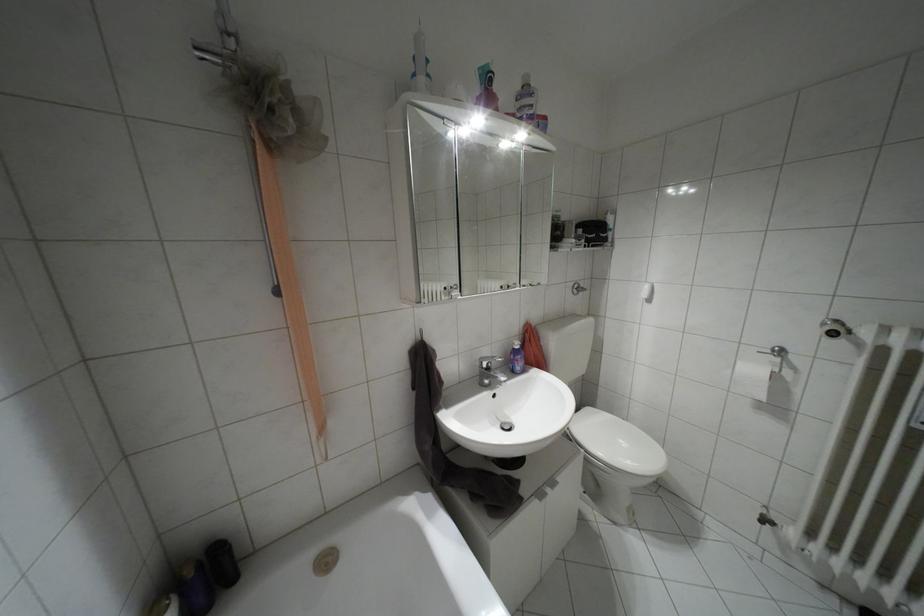
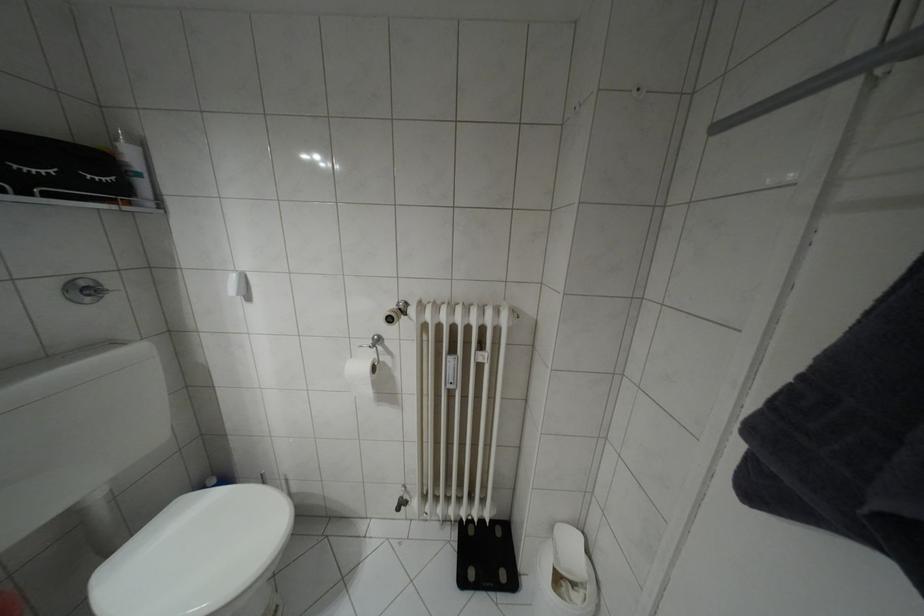
Find the pixel in the second image that matches [760,395] in the first image.

(369, 392)